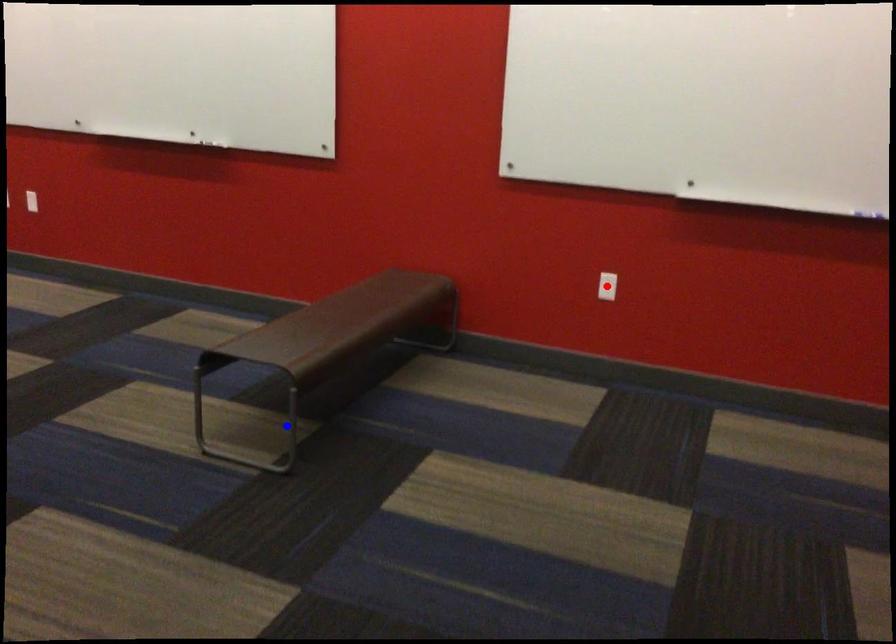
Question: Which of the two points in the image is closer to the camera?

Choices:
 (A) Blue point is closer.
 (B) Red point is closer.

Answer: (A)